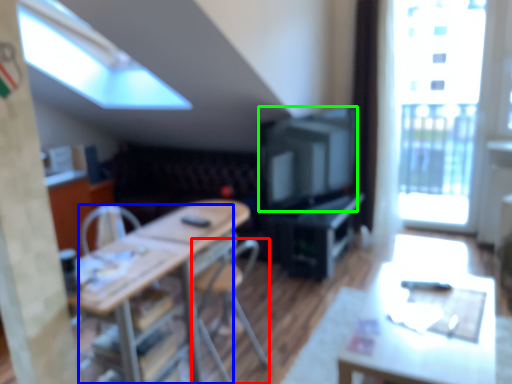
Question: Based on their relative distances, which object is nearer to chair (highlighted by a red box)? Choose from chair (highlighted by a blue box) and television (highlighted by a green box).

Choices:
 (A) chair
 (B) television

Answer: (A)